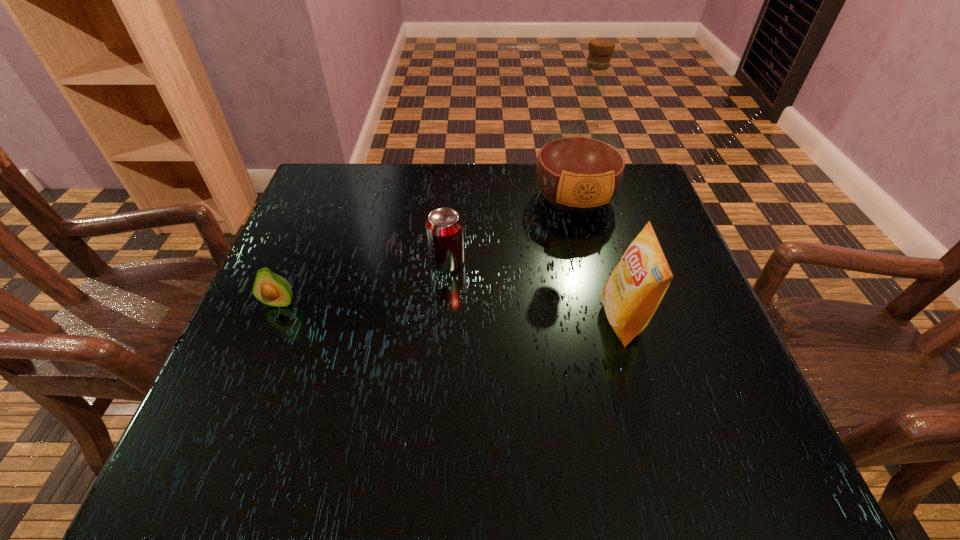
You are a GUI agent. You are given a task and a screenshot of the screen. Output one action in this format:
    pyautogui.click(x=<x>, y=<y>)
    Task: Click on the unoccupied area between the liquor and the third object from right to left
    
    Given the screenshot: What is the action you would take?
    pyautogui.click(x=511, y=230)

Image resolution: width=960 pixels, height=540 pixels. I want to click on vacant area between the third shortest object and the tallest object, so click(599, 258).

Where is `free point between the crisp (potato chip) and the third tallest object`? This screenshot has width=960, height=540. free point between the crisp (potato chip) and the third tallest object is located at coordinates (535, 291).

At what (x,y) coordinates should I click in order to perform the action: click on vacant region between the crisp (potato chip) and the second object from left to right. Please return your answer as a coordinate pair (x, y). The width and height of the screenshot is (960, 540). Looking at the image, I should click on (535, 291).

Image resolution: width=960 pixels, height=540 pixels. What are the coordinates of `the second closest object to the third tallest object` in the screenshot? It's located at (269, 288).

Locate which object ranks second in proximity to the shortest object. Please provide its 2D coordinates. Your answer should be formatted as a tuple, i.e. [(x, y)], where the tuple contains the x and y coordinates of a point satisfying the conditions above.

[(580, 168)]